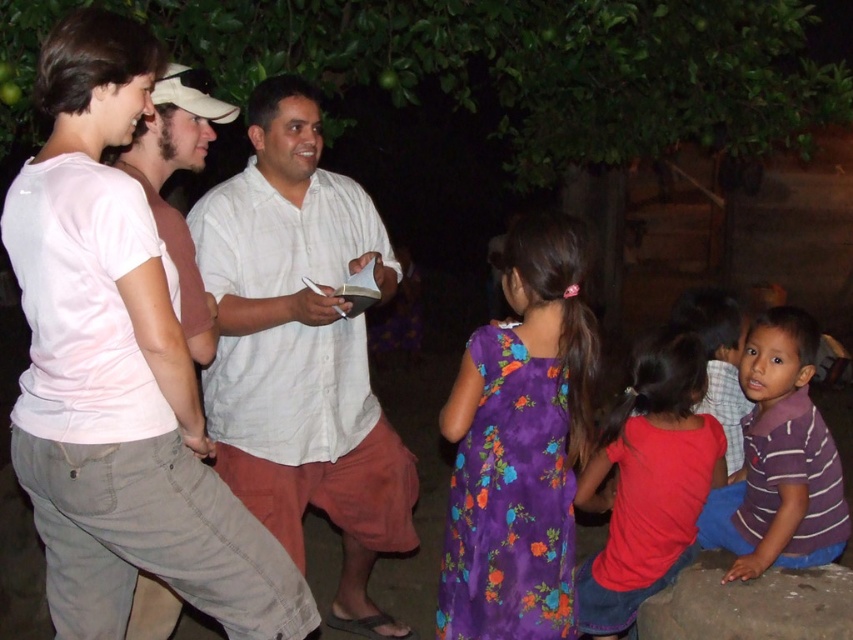
Question: Is purple striped shirt at lower right smaller than pink cotton shirt at left?

Choices:
 (A) no
 (B) yes

Answer: (A)

Question: Which object is farther from the camera taking this photo?

Choices:
 (A) striped cotton shirt at center
 (B) red cotton shirt at lower right

Answer: (A)

Question: Where is red cotton shirt at lower right located in relation to pink cotton shirt at left in the image?

Choices:
 (A) left
 (B) right

Answer: (B)

Question: Which of the following is the farthest from the observer?

Choices:
 (A) purple floral dress at center
 (B) striped cotton shirt at center
 (C) pink cotton shirt at left
 (D) red cotton shirt at lower right

Answer: (B)

Question: Can you confirm if red cotton shirt at lower right is positioned to the right of striped cotton shirt at center?

Choices:
 (A) yes
 (B) no

Answer: (B)

Question: Among these points, which one is nearest to the camera?

Choices:
 (A) (463, 630)
 (B) (340, 387)
 (C) (683, 294)

Answer: (A)